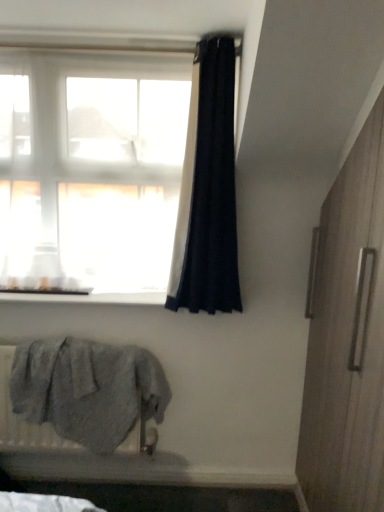
Question: Is gray fluffy towel at lower left bigger or smaller than wooden screen door at right?

Choices:
 (A) big
 (B) small

Answer: (B)

Question: From a real-world perspective, is gray fluffy towel at lower left physically located above or below wooden screen door at right?

Choices:
 (A) above
 (B) below

Answer: (B)

Question: Which is nearer to the white smooth window sill at lower left?

Choices:
 (A) translucent white curtain at upper left
 (B) gray fluffy towel at lower left
 (C) black fabric curtain at upper center
 (D) wooden screen door at right

Answer: (A)

Question: Which object is the farthest from the black fabric curtain at upper center?

Choices:
 (A) white smooth window sill at lower left
 (B) wooden screen door at right
 (C) gray fluffy towel at lower left
 (D) translucent white curtain at upper left

Answer: (C)